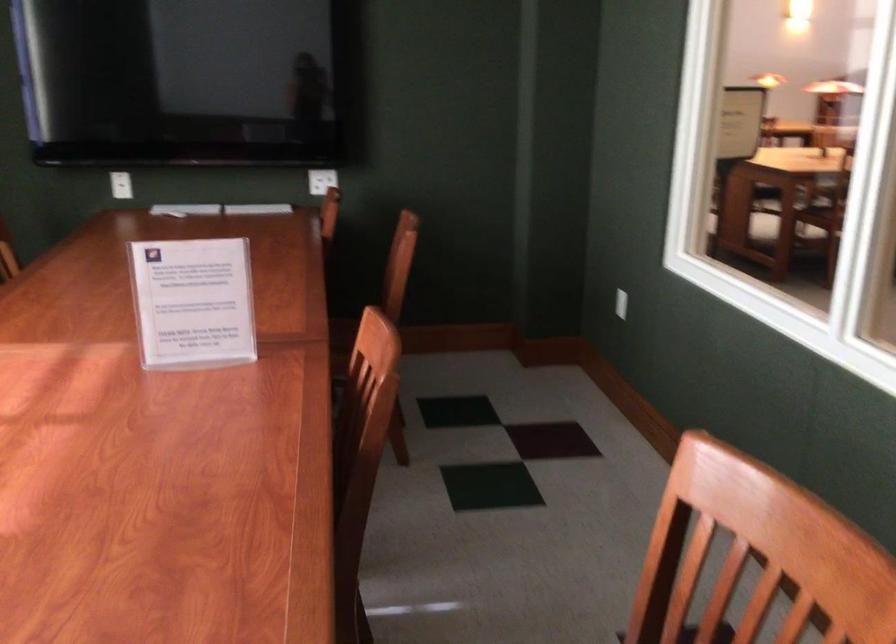
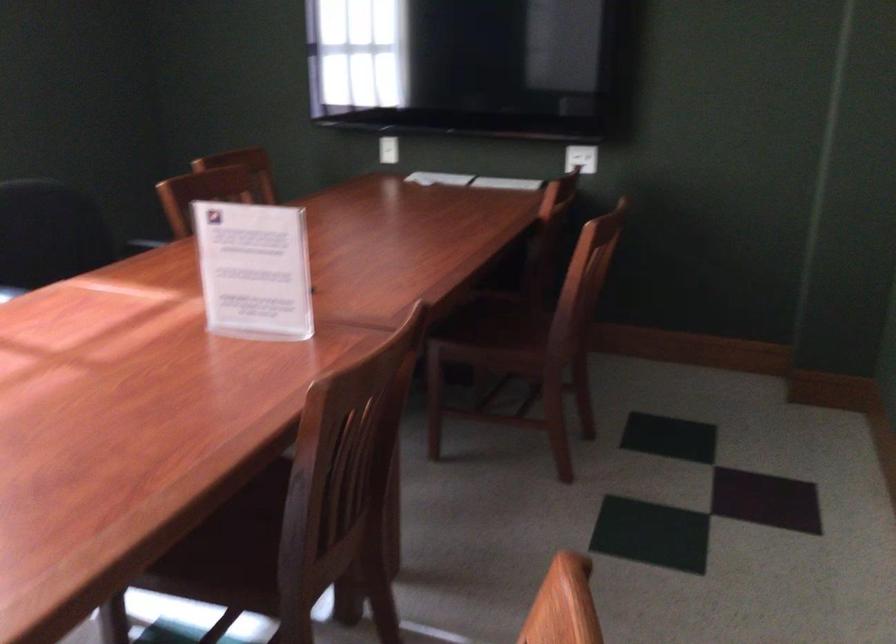
Question: The camera is either moving clockwise (left) or counter-clockwise (right) around the object. The first image is from the beginning of the video and the second image is from the end. Is the camera moving left or right when shooting the video?

Choices:
 (A) Left
 (B) Right

Answer: (B)